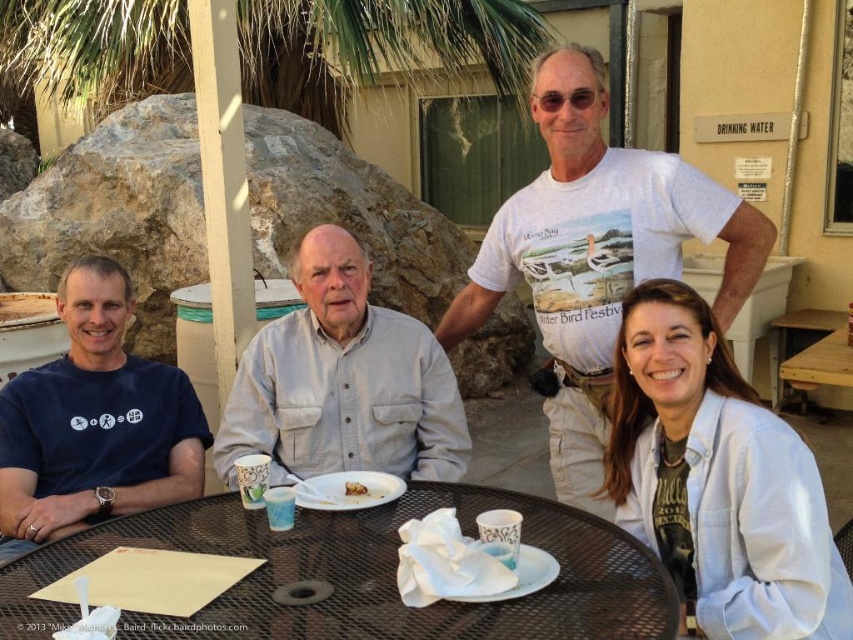
You are standing at the round metal table where the group is seated. There are two points marked on the ground. The first point is at coordinates point (x=714, y=355) and the second point is at point (x=9, y=392). If you were to walk from the table towards each point, which point would you reach first?

Point (x=714, y=355) is in front of point (x=9, y=392), so you would reach point (x=714, y=355) first when walking from the table.